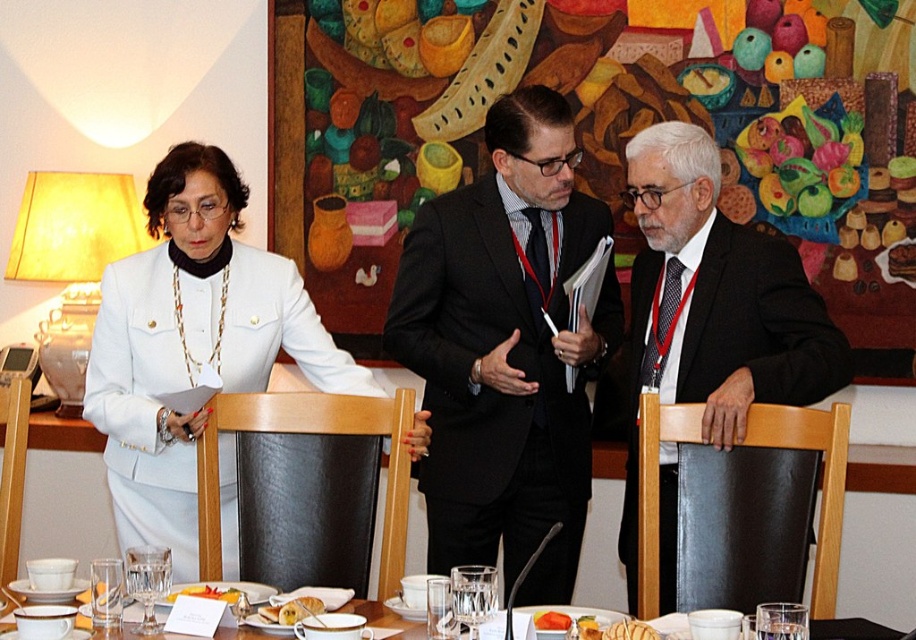
Which is in front, point (189, 589) or point (544, 621)?

Point (544, 621) is in front.

Is yellow matte bread at center thinner than orange matte carrot at center?

No.

Does point (235, 593) come behind point (551, 624)?

Yes.

Locate an element on the screen. Image resolution: width=916 pixels, height=640 pixels. yellow matte bread at center is located at coordinates (208, 593).

Which is below, white matte jacket at center or dark gray suit at right?

dark gray suit at right

Does white matte jacket at center have a smaller size compared to dark gray suit at right?

Yes.

At what (x,y) coordinates should I click in order to perform the action: click on white matte jacket at center. Please return your answer as a coordinate pair (x, y). Looking at the image, I should click on (192, 344).

Does dark gray suit at right have a greater width compared to yellow matte bread at center?

Yes.

Which is in front, point (689, 248) or point (229, 592)?

Point (229, 592)

The image size is (916, 640). In order to click on dark gray suit at right in this screenshot , I will do `click(724, 339)`.